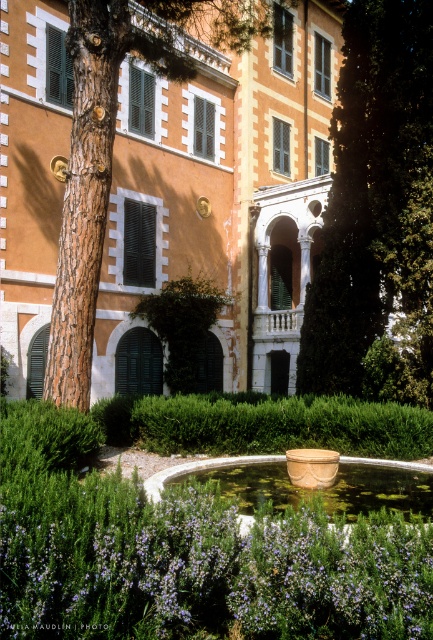
Question: Which of the following is the farthest from the observer?

Choices:
 (A) matte orange building at center
 (B) purple textured flower at center
 (C) green leafy hedge at center
 (D) green leafy tree at center

Answer: (A)

Question: Estimate the real-world distances between objects in this image. Which object is closer to the purple textured flower at center?

Choices:
 (A) green leafy hedge at center
 (B) matte orange building at center

Answer: (A)

Question: Considering the relative positions of purple textured flower at center and green leafy tree at center in the image provided, where is purple textured flower at center located with respect to green leafy tree at center?

Choices:
 (A) below
 (B) above

Answer: (A)

Question: Which is nearer to the green matte bush at center?

Choices:
 (A) green leafy hedge at center
 (B) matte gold basin at center
 (C) matte orange building at center
 (D) purple textured flower at center

Answer: (C)

Question: In this image, where is purple textured flower at center located relative to green leafy hedge at center?

Choices:
 (A) left
 (B) right

Answer: (A)

Question: Can you confirm if purple textured flower at center is wider than green matte bush at center?

Choices:
 (A) no
 (B) yes

Answer: (A)